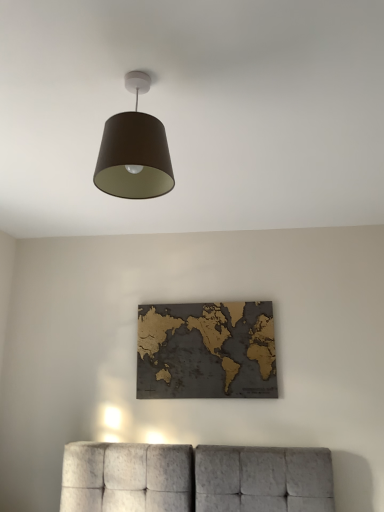
Where is `matte brown shade at upper center`? The height and width of the screenshot is (512, 384). matte brown shade at upper center is located at coordinates (134, 151).

What do you see at coordinates (134, 151) in the screenshot?
I see `matte brown shade at upper center` at bounding box center [134, 151].

Measure the distance between point (102, 185) and camera.

Point (102, 185) and camera are 4.66 feet apart from each other.

Measure the distance between point (214, 387) and camera.

They are 2.68 meters apart.

Describe the element at coordinates (206, 351) in the screenshot. This screenshot has width=384, height=512. I see `gold textured map at center` at that location.

Locate an element on the screen. gold textured map at center is located at coordinates (206, 351).

The image size is (384, 512). Identify the location of matte brown shade at upper center. (134, 151).

In the scene shown: Is gold textured map at center at the left side of matte brown shade at upper center?

No, gold textured map at center is not to the left of matte brown shade at upper center.

Considering the relative positions of gold textured map at center and matte brown shade at upper center in the image provided, is gold textured map at center in front of matte brown shade at upper center?

No.

Which is further, [169,325] or [136,134]?

The point [169,325] is farther from the camera.

From the image's perspective, between gold textured map at center and matte brown shade at upper center, which one is located above?

matte brown shade at upper center appears higher in the image.

From a real-world perspective, who is located higher, gold textured map at center or matte brown shade at upper center?

matte brown shade at upper center.

From the picture: Looking at their sizes, would you say gold textured map at center is wider or thinner than matte brown shade at upper center?

gold textured map at center is thinner than matte brown shade at upper center.

Does gold textured map at center have a greater height compared to matte brown shade at upper center?

Correct, gold textured map at center is much taller as matte brown shade at upper center.

Based on their sizes in the image, would you say gold textured map at center is bigger or smaller than matte brown shade at upper center?

gold textured map at center is smaller than matte brown shade at upper center.

Is gold textured map at center spatially inside matte brown shade at upper center, or outside of it?

gold textured map at center exists outside the volume of matte brown shade at upper center.

Is the surface of gold textured map at center in direct contact with matte brown shade at upper center?

No, gold textured map at center is not with matte brown shade at upper center.

Is gold textured map at center looking in the opposite direction of matte brown shade at upper center?

gold textured map at center does not have its back to matte brown shade at upper center.

How many degrees apart are the facing directions of gold textured map at center and matte brown shade at upper center?

gold textured map at center and matte brown shade at upper center are facing 92 degrees away from each other.

In order to click on picture frame below the matte brown shade at upper center (from the image's perspective) in this screenshot , I will do `click(206, 351)`.

Can you confirm if matte brown shade at upper center is positioned to the left of gold textured map at center?

Correct, you'll find matte brown shade at upper center to the left of gold textured map at center.

Does matte brown shade at upper center come behind gold textured map at center?

No, matte brown shade at upper center is closer to the camera.

Does point (120, 148) lie behind point (257, 342)?

No.

In the scene shown: From the image's perspective, does matte brown shade at upper center appear lower than gold textured map at center?

Actually, matte brown shade at upper center appears above gold textured map at center in the image.

From a real-world perspective, is matte brown shade at upper center above or below gold textured map at center?

From a real-world perspective, matte brown shade at upper center is physically above gold textured map at center.

Which object is thinner, matte brown shade at upper center or gold textured map at center?

gold textured map at center is thinner.

Does matte brown shade at upper center have a lesser height compared to gold textured map at center?

Correct, matte brown shade at upper center is not as tall as gold textured map at center.

Who is bigger, matte brown shade at upper center or gold textured map at center?

With larger size is matte brown shade at upper center.

Is matte brown shade at upper center positioned beyond the bounds of gold textured map at center?

Yes, matte brown shade at upper center is outside of gold textured map at center.

Is the surface of matte brown shade at upper center in direct contact with gold textured map at center?

No, matte brown shade at upper center is not making contact with gold textured map at center.

Is matte brown shade at upper center turned away from gold textured map at center?

No, matte brown shade at upper center is not facing away from gold textured map at center.

In the image, there is a matte brown shade at upper center. Where is `picture frame below it (from the image's perspective)`? The width and height of the screenshot is (384, 512). picture frame below it (from the image's perspective) is located at coordinates (206, 351).

Where is `lamp on the left of gold textured map at center`? lamp on the left of gold textured map at center is located at coordinates (134, 151).

The width and height of the screenshot is (384, 512). Find the location of `lamp above the gold textured map at center (from a real-world perspective)`. lamp above the gold textured map at center (from a real-world perspective) is located at coordinates (134, 151).